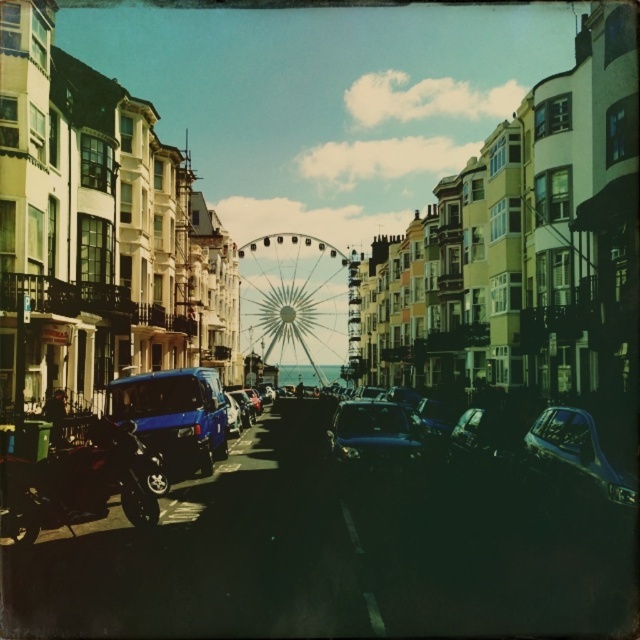
Based on the photo, you are standing on the street looking towards the Ferris wheel. There are two points marked on the ground in front of you. One is at coordinates point [163,424] and the other at point [572,449]. Which point is closer to your current position?

Point [163,424] is closer to your current position because it is further to the viewer than point [572,449].